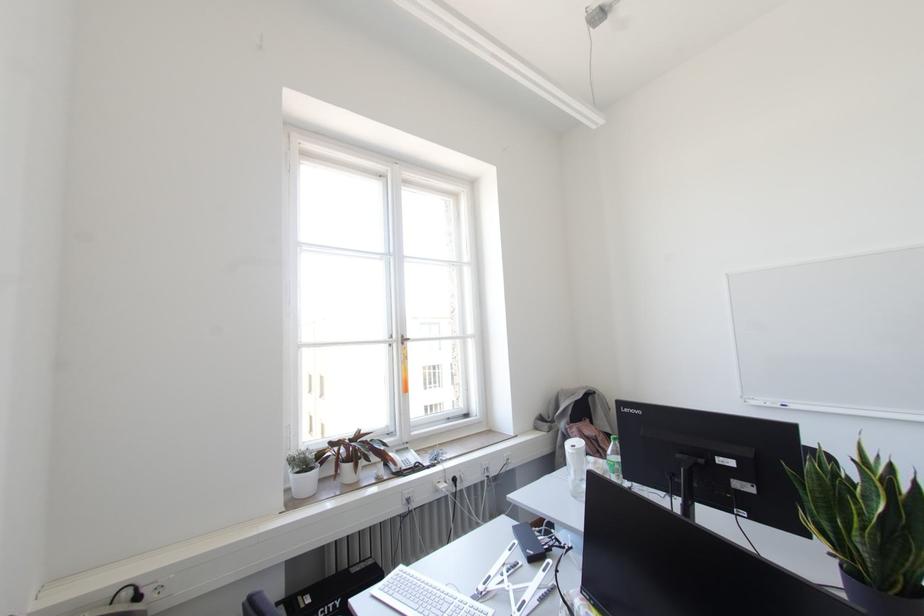
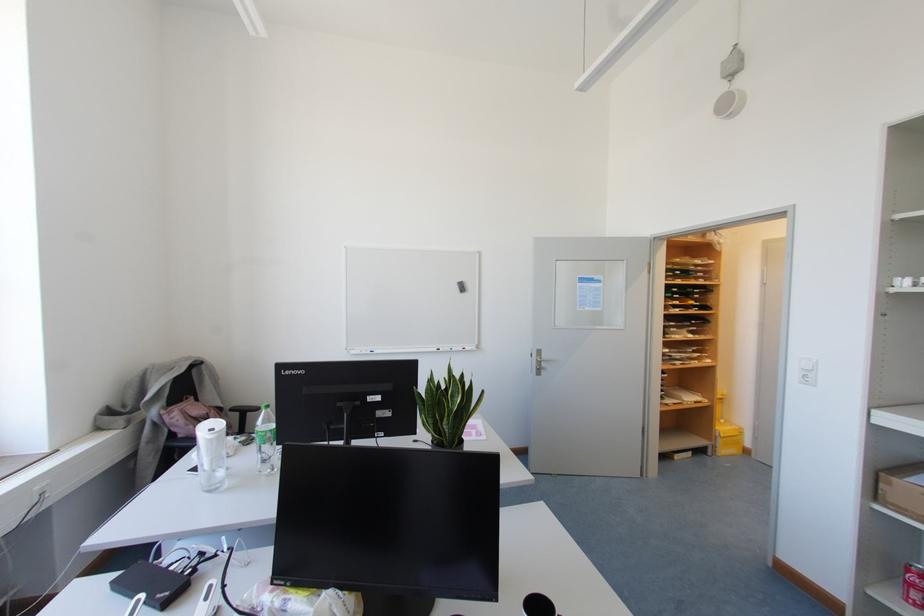
Question: The camera is either moving clockwise (left) or counter-clockwise (right) around the object. The first image is from the beginning of the video and the second image is from the end. Is the camera moving left or right when shooting the video?

Choices:
 (A) Left
 (B) Right

Answer: (A)